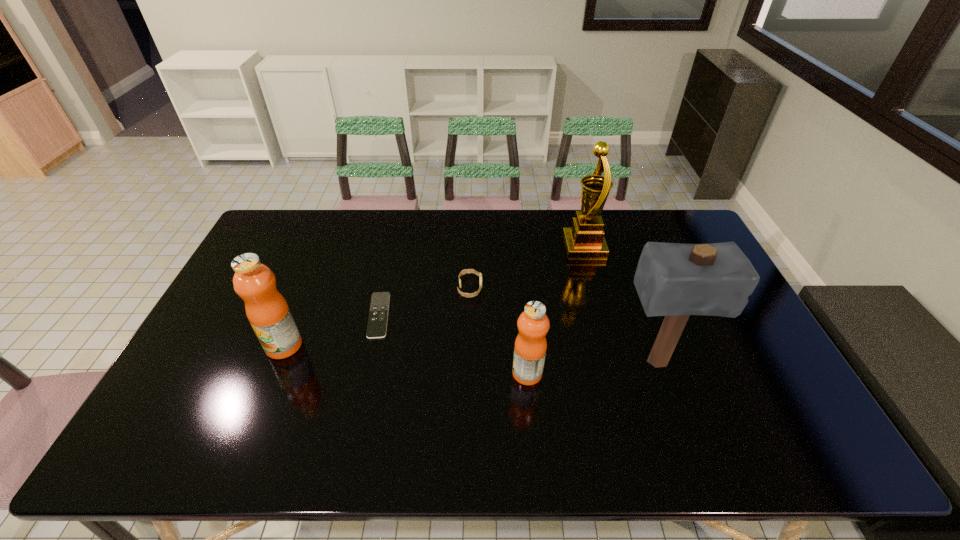
I want to click on the taller fruit juice, so click(266, 309).

At what (x,y) coordinates should I click in order to perform the action: click on the farther fruit juice. Please return your answer as a coordinate pair (x, y). Looking at the image, I should click on (266, 309).

The image size is (960, 540). I want to click on the shorter fruit juice, so click(x=533, y=324).

Identify the location of the fourth object from left to right. Image resolution: width=960 pixels, height=540 pixels. (533, 324).

This screenshot has width=960, height=540. I want to click on award, so click(x=585, y=239).

Locate an element on the screen. This screenshot has width=960, height=540. the shortest object is located at coordinates (378, 315).

In order to click on the second object from left to right in this screenshot , I will do `click(378, 315)`.

Locate an element on the screen. The height and width of the screenshot is (540, 960). mallet is located at coordinates (x=676, y=280).

Where is `watch`? watch is located at coordinates 464,271.

Locate an element on the screen. This screenshot has width=960, height=540. the fifth tallest object is located at coordinates (464, 271).